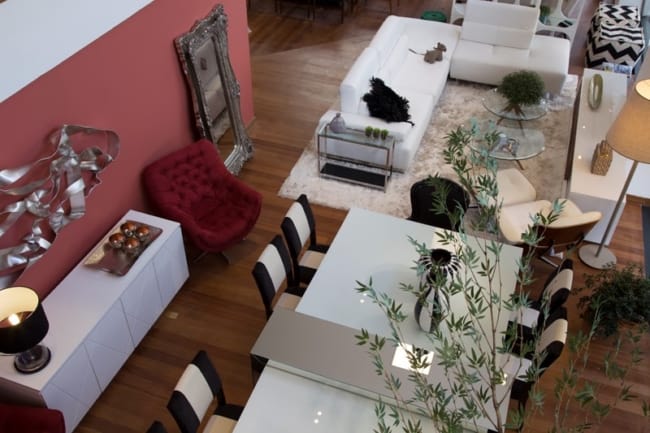
You are a GUI agent. You are given a task and a screenshot of the screen. Output one action in this format:
    pyautogui.click(x=<x>, y=<y>)
    Task: Click on the white table
    
    Given the screenshot: What is the action you would take?
    pyautogui.click(x=369, y=239)